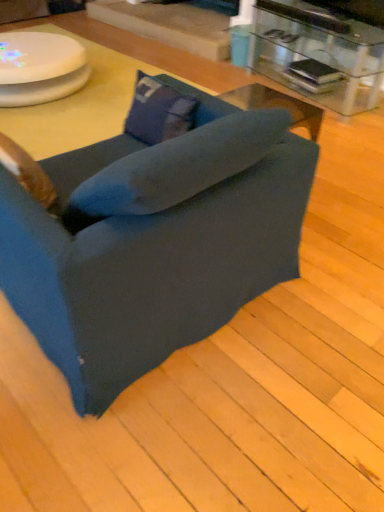
Question: Considering the positions of blue fabric pillow at center and dark blue fabric chair at center in the image, is blue fabric pillow at center taller or shorter than dark blue fabric chair at center?

Choices:
 (A) short
 (B) tall

Answer: (A)

Question: Considering their positions, is blue fabric pillow at center located in front of or behind dark blue fabric chair at center?

Choices:
 (A) behind
 (B) front

Answer: (A)

Question: Estimate the real-world distances between objects in this image. Which object is closer to the white glossy round table at upper left?

Choices:
 (A) dark blue fabric chair at center
 (B) transparent glass table at upper right
 (C) blue fabric pillow at center

Answer: (C)

Question: Considering the real-world distances, which object is closest to the white glossy round table at upper left?

Choices:
 (A) blue fabric pillow at center
 (B) transparent glass table at upper right
 (C) dark blue fabric chair at center

Answer: (A)